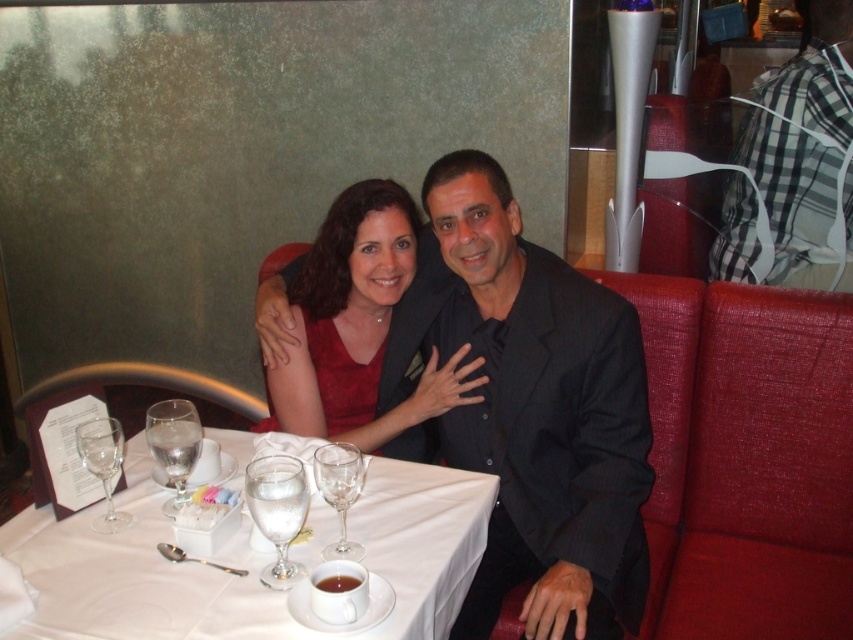
At what (x,y) coordinates should I click in order to perform the action: click on matte red dress at center. Please return your answer as a coordinate pair (x, y). This screenshot has height=640, width=853. Looking at the image, I should click on (357, 324).

Is matte red dress at center smaller than clear glass wine glass at table center?

Actually, matte red dress at center might be larger than clear glass wine glass at table center.

Who is more forward, (299, 387) or (335, 547)?

Point (335, 547) is more forward.

At what (x,y) coordinates should I click in order to perform the action: click on matte red dress at center. Please return your answer as a coordinate pair (x, y). The width and height of the screenshot is (853, 640). Looking at the image, I should click on (x=357, y=324).

Who is more distant from viewer, (212, 436) or (309, 433)?

Positioned behind is point (309, 433).

Does point (460, 604) come closer to viewer compared to point (363, 225)?

Yes.

The height and width of the screenshot is (640, 853). Identify the location of white cloth at center. (137, 576).

You are a GUI agent. You are given a task and a screenshot of the screen. Output one action in this format:
    pyautogui.click(x=<x>, y=<y>)
    Task: Click on the clear glass wine glass at table center
    The image size is (853, 640).
    Given the screenshot: What is the action you would take?
    pyautogui.click(x=339, y=492)

Does clear glass wine glass at table center have a greater width compared to clear glass wine glass at lower left?

No, clear glass wine glass at table center is not wider than clear glass wine glass at lower left.

I want to click on clear glass wine glass at table center, so click(339, 492).

Where is `clear glass wine glass at table center`? This screenshot has width=853, height=640. clear glass wine glass at table center is located at coordinates (339, 492).